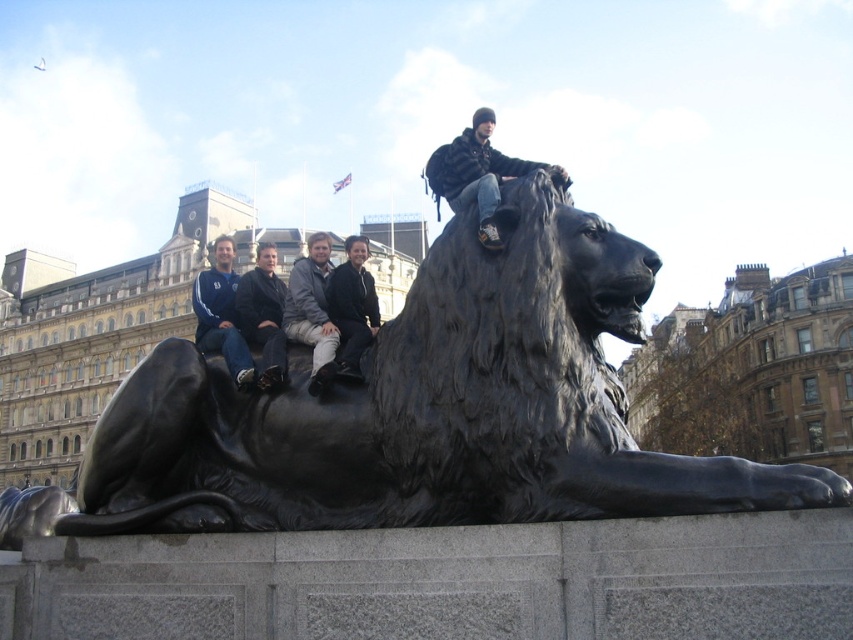
Question: Is matte black jacket at upper center bigger than gray fabric jacket at upper center?

Choices:
 (A) yes
 (B) no

Answer: (B)

Question: Which of the following is the closest to the observer?

Choices:
 (A) (x=245, y=310)
 (B) (x=361, y=285)

Answer: (A)

Question: Can you confirm if black matte jacket at upper center is thinner than dark brown leather jacket at center?

Choices:
 (A) yes
 (B) no

Answer: (A)

Question: Among these objects, which one is nearest to the camera?

Choices:
 (A) dark blue jacket at upper left
 (B) black matte jacket at upper center
 (C) gray fabric jacket at upper center
 (D) dark brown leather jacket at center

Answer: (C)

Question: Which of the following is the farthest from the observer?

Choices:
 (A) dark brown leather jacket at center
 (B) black polished stone lion at center
 (C) black matte jacket at upper center
 (D) gray fabric jacket at upper center

Answer: (A)

Question: Does black polished stone lion at center appear on the right side of matte black jacket at upper center?

Choices:
 (A) no
 (B) yes

Answer: (A)